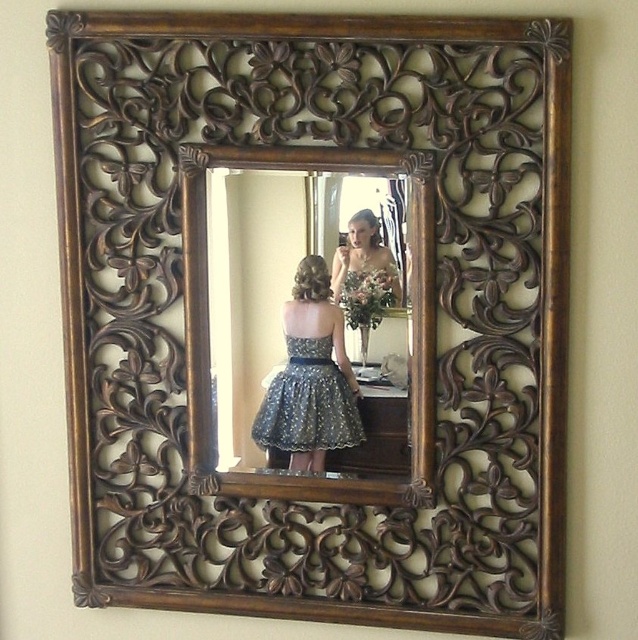
In the scene shown: You are an interior designer assessing the placement of the sparkly dark blue dress at center and the green matte bouquet at center in the mirror reflection. Which object is closer to the bottom edge of the mirror?

The sparkly dark blue dress at center is positioned under the green matte bouquet at center, so it is closer to the bottom edge of the mirror.

You are a photographer setting up for a photoshoot. You have a camera with a 100cm wide lens. You need to capture both the wooden carved mirror at center and the sparkly dark blue dress at center in the same frame. Can you fit both objects in the frame without moving the camera?

The wooden carved mirror at center is wider than the sparkly dark blue dress at center. Since the camera lens is 100cm wide, both objects can be captured in the frame as long as their combined width does not exceed 100cm. However, the exact fit depends on their individual widths and positioning.